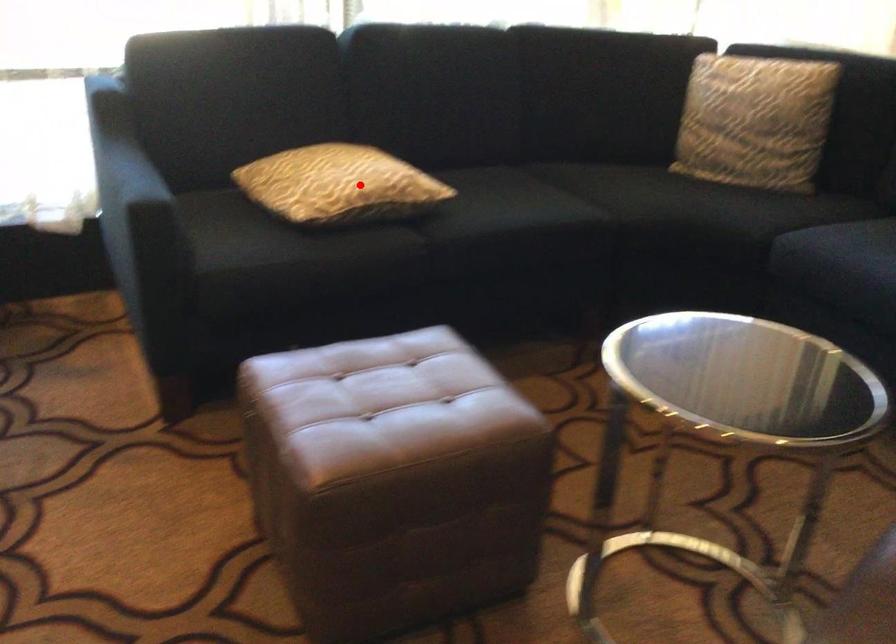
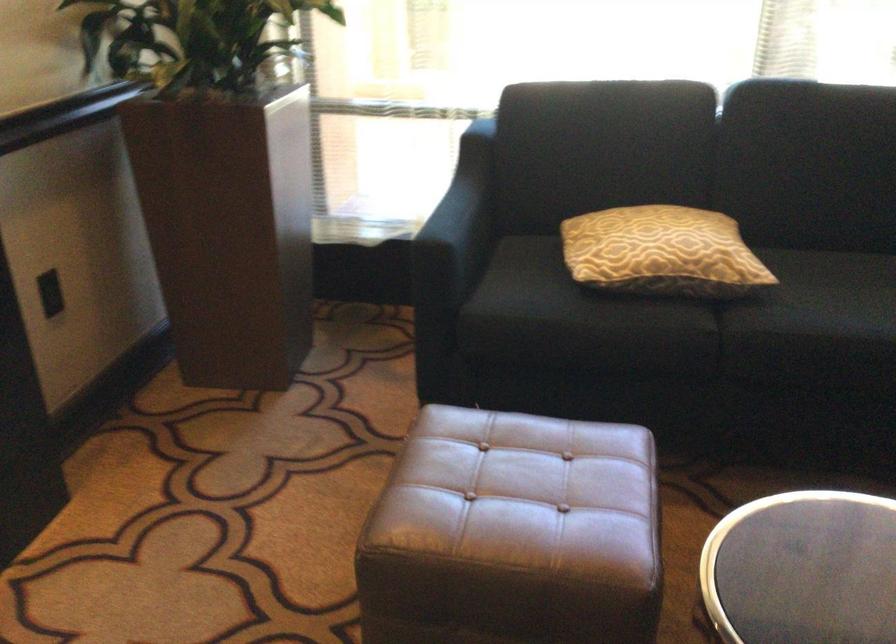
In the second image, find the point that corresponds to the highlighted location in the first image.

(661, 252)